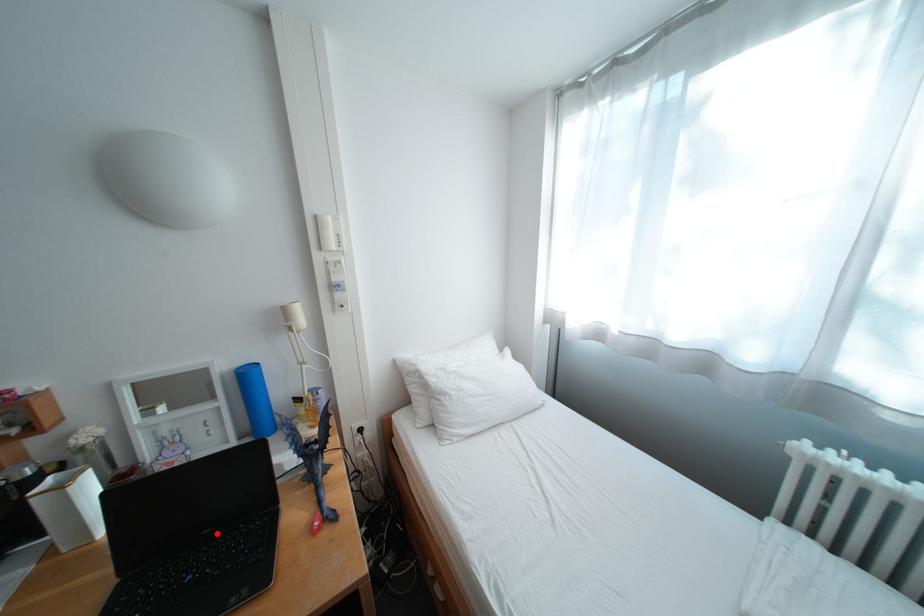
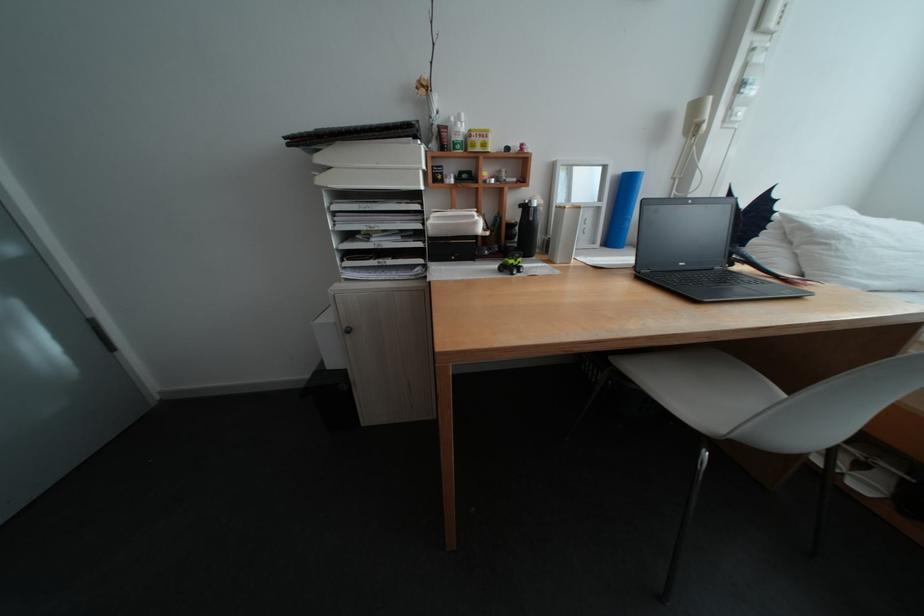
Find the pixel in the second image that matches the highlighted location in the first image.

(694, 265)